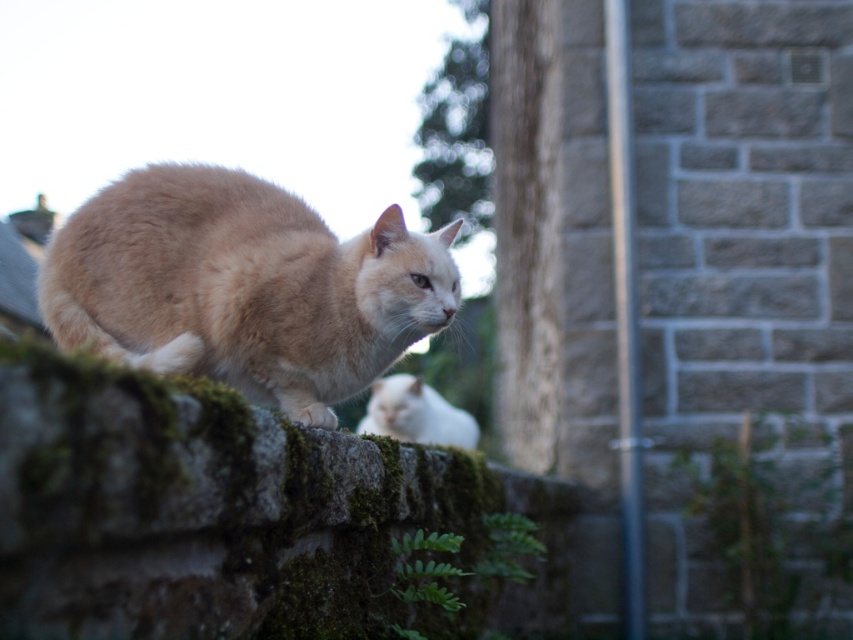
Question: Is light brown fur cat at center above white fluffy cat at center?

Choices:
 (A) yes
 (B) no

Answer: (A)

Question: Does light brown fur cat at center appear on the right side of white fluffy cat at center?

Choices:
 (A) yes
 (B) no

Answer: (B)

Question: Which of the following is the farthest from the observer?

Choices:
 (A) (450, 404)
 (B) (160, 310)

Answer: (A)

Question: Can you confirm if light brown fur cat at center is bigger than white fluffy cat at center?

Choices:
 (A) yes
 (B) no

Answer: (A)

Question: Which of the following is the farthest from the observer?

Choices:
 (A) (431, 404)
 (B) (300, 340)

Answer: (A)